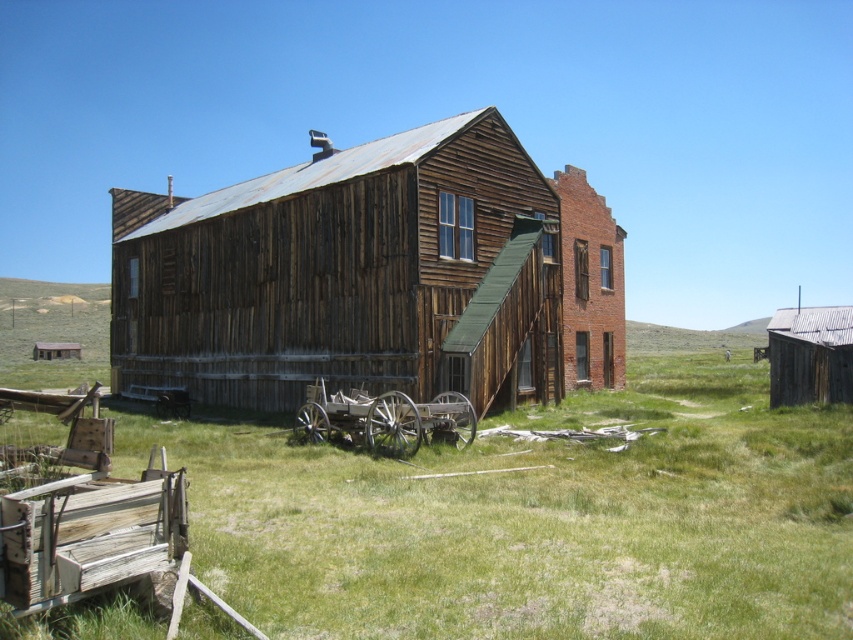
Does rustic wood wagon at center appear under rusty corrugated tin hut at right?

Indeed, rustic wood wagon at center is positioned under rusty corrugated tin hut at right.

Is rustic wood wagon at center above rusty corrugated tin hut at right?

Actually, rustic wood wagon at center is below rusty corrugated tin hut at right.

Is point (358, 403) farther from viewer compared to point (848, 378)?

No, it is not.

Where is `rustic wood wagon at center`? This screenshot has height=640, width=853. rustic wood wagon at center is located at coordinates (384, 419).

Can you confirm if weathered wood building at center is bigger than rustic wood wagon at center?

Indeed, weathered wood building at center has a larger size compared to rustic wood wagon at center.

I want to click on weathered wood building at center, so click(370, 276).

Locate an element on the screen. Image resolution: width=853 pixels, height=640 pixels. weathered wood building at center is located at coordinates (370, 276).

Consider the image. Which is more to the right, weathered wood building at center or rusty corrugated tin hut at right?

rusty corrugated tin hut at right is more to the right.

This screenshot has height=640, width=853. What do you see at coordinates (370, 276) in the screenshot? I see `weathered wood building at center` at bounding box center [370, 276].

The image size is (853, 640). What are the coordinates of `weathered wood building at center` in the screenshot? It's located at (370, 276).

The height and width of the screenshot is (640, 853). Find the location of `weathered wood building at center`. weathered wood building at center is located at coordinates (370, 276).